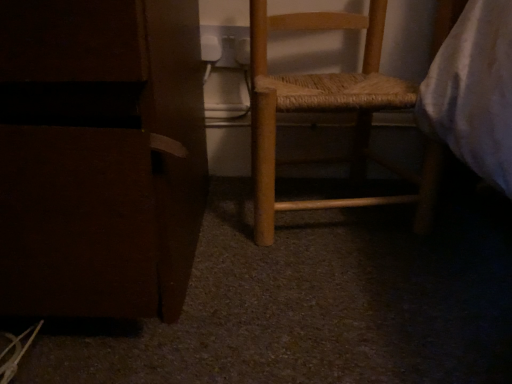
Question: Which direction should I rotate to look at wooden woven seat at center, marked as the 2th furniture in a left-to-right arrangement, — up or down?

Choices:
 (A) up
 (B) down

Answer: (A)

Question: Considering the relative sizes of matte brown cabinet at left, placed as the first furniture when sorted from left to right, and wooden woven seat at center, marked as the 2th furniture in a left-to-right arrangement, in the image provided, is matte brown cabinet at left, placed as the first furniture when sorted from left to right, smaller than wooden woven seat at center, marked as the 2th furniture in a left-to-right arrangement,?

Choices:
 (A) yes
 (B) no

Answer: (B)

Question: Does matte brown cabinet at left, placed as the first furniture when sorted from left to right, lie behind wooden woven seat at center, arranged as the 1th furniture when viewed from the right?

Choices:
 (A) no
 (B) yes

Answer: (A)

Question: Does matte brown cabinet at left, placed as the 2th furniture when sorted from right to left, have a lesser height compared to wooden woven seat at center, arranged as the 1th furniture when viewed from the right?

Choices:
 (A) yes
 (B) no

Answer: (A)

Question: Does matte brown cabinet at left, placed as the 2th furniture when sorted from right to left, have a greater height compared to wooden woven seat at center, arranged as the 1th furniture when viewed from the right?

Choices:
 (A) no
 (B) yes

Answer: (A)

Question: Is matte brown cabinet at left, placed as the 2th furniture when sorted from right to left, outside wooden woven seat at center, arranged as the 1th furniture when viewed from the right?

Choices:
 (A) no
 (B) yes

Answer: (B)

Question: From the image's perspective, is matte brown cabinet at left, placed as the first furniture when sorted from left to right, beneath wooden woven seat at center, marked as the 2th furniture in a left-to-right arrangement?

Choices:
 (A) no
 (B) yes

Answer: (B)

Question: Does wooden woven seat at center, arranged as the 1th furniture when viewed from the right, have a smaller size compared to matte brown cabinet at left, placed as the first furniture when sorted from left to right?

Choices:
 (A) yes
 (B) no

Answer: (A)

Question: Can you confirm if wooden woven seat at center, marked as the 2th furniture in a left-to-right arrangement, is thinner than matte brown cabinet at left, placed as the first furniture when sorted from left to right?

Choices:
 (A) yes
 (B) no

Answer: (A)

Question: Is wooden woven seat at center, arranged as the 1th furniture when viewed from the right, not within matte brown cabinet at left, placed as the 2th furniture when sorted from right to left?

Choices:
 (A) yes
 (B) no

Answer: (A)

Question: From the image's perspective, is wooden woven seat at center, marked as the 2th furniture in a left-to-right arrangement, beneath matte brown cabinet at left, placed as the 2th furniture when sorted from right to left?

Choices:
 (A) no
 (B) yes

Answer: (A)

Question: Is wooden woven seat at center, marked as the 2th furniture in a left-to-right arrangement, at the right side of matte brown cabinet at left, placed as the first furniture when sorted from left to right?

Choices:
 (A) no
 (B) yes

Answer: (B)

Question: Is the position of wooden woven seat at center, arranged as the 1th furniture when viewed from the right, less distant than that of matte brown cabinet at left, placed as the 2th furniture when sorted from right to left?

Choices:
 (A) no
 (B) yes

Answer: (A)

Question: From a real-world perspective, is wooden woven seat at center, marked as the 2th furniture in a left-to-right arrangement, positioned above or below matte brown cabinet at left, placed as the first furniture when sorted from left to right?

Choices:
 (A) above
 (B) below

Answer: (B)